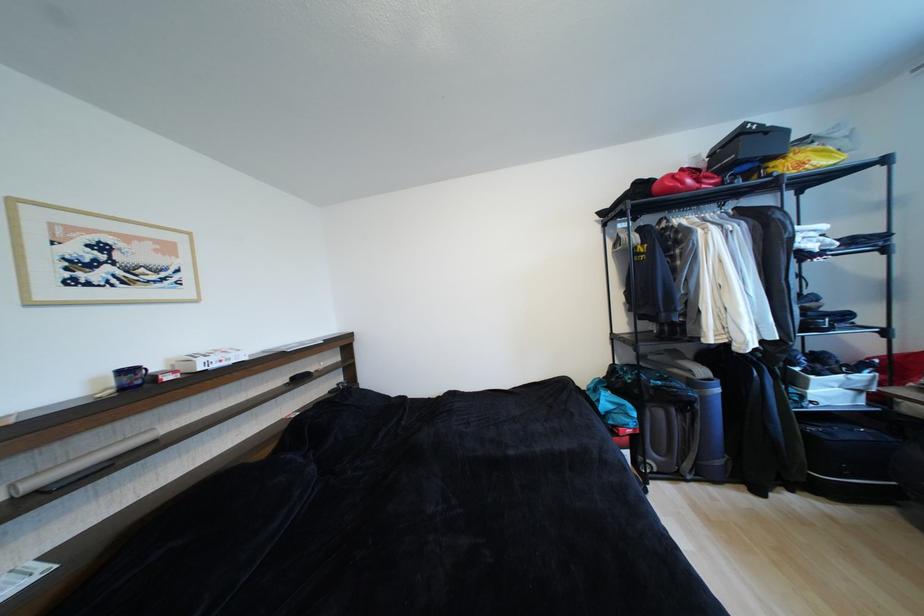
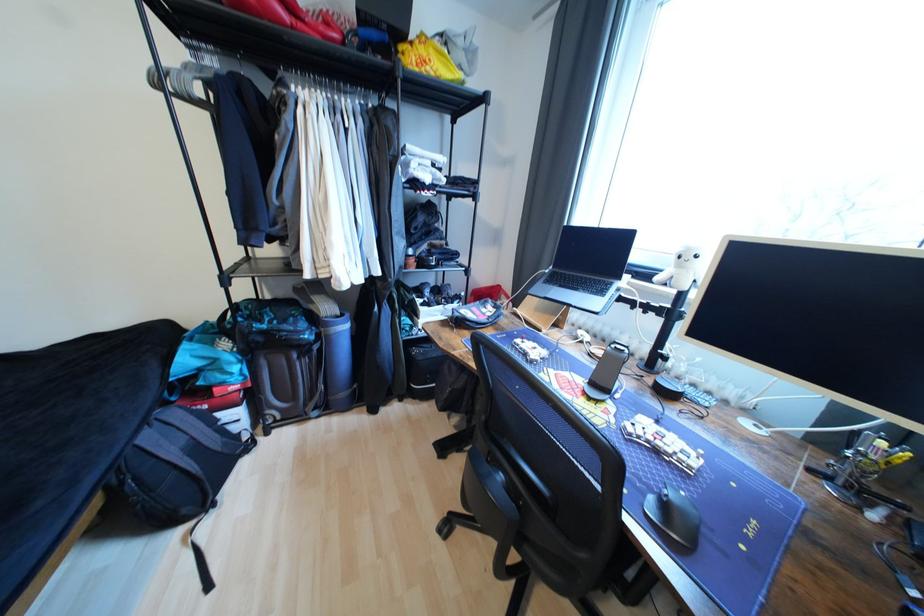
The point at (780, 166) is marked in the first image. Where is the corresponding point in the second image?

(407, 49)